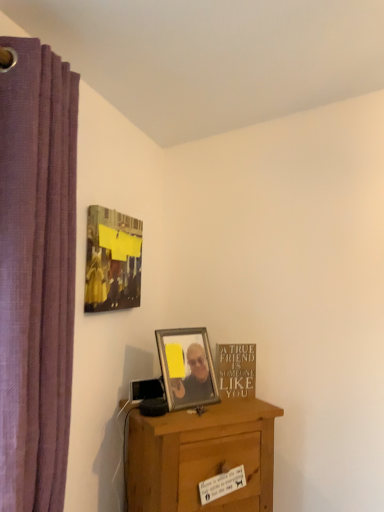
Question: Could you tell me if metallic silver picture frame at center, acting as the 2th picture frame starting from the top, is turned towards gold metallic sign at lower right?

Choices:
 (A) yes
 (B) no

Answer: (B)

Question: Is metallic silver picture frame at center, acting as the 2th picture frame starting from the top, outside of gold metallic sign at lower right?

Choices:
 (A) no
 (B) yes

Answer: (B)

Question: Is metallic silver picture frame at center, the first picture frame when ordered from bottom to top, next to gold metallic sign at lower right?

Choices:
 (A) no
 (B) yes

Answer: (A)

Question: Considering the relative sizes of metallic silver picture frame at center, the first picture frame when ordered from bottom to top, and gold metallic sign at lower right in the image provided, is metallic silver picture frame at center, the first picture frame when ordered from bottom to top, wider than gold metallic sign at lower right?

Choices:
 (A) no
 (B) yes

Answer: (B)

Question: Is gold metallic sign at lower right surrounded by metallic silver picture frame at center, which is the second picture frame from left to right?

Choices:
 (A) no
 (B) yes

Answer: (A)

Question: From their relative heights in the image, would you say matte black picture frame at upper left, which is the 1th picture frame in left-to-right order, is taller or shorter than wooden desk at lower center?

Choices:
 (A) short
 (B) tall

Answer: (A)

Question: In terms of size, does matte black picture frame at upper left, placed as the first picture frame when sorted from top to bottom, appear bigger or smaller than wooden desk at lower center?

Choices:
 (A) small
 (B) big

Answer: (A)

Question: From the image's perspective, is matte black picture frame at upper left, placed as the first picture frame when sorted from top to bottom, above or below wooden desk at lower center?

Choices:
 (A) above
 (B) below

Answer: (A)

Question: Which is correct: matte black picture frame at upper left, the second picture frame from the right, is inside wooden desk at lower center, or outside of it?

Choices:
 (A) inside
 (B) outside

Answer: (B)

Question: Would you say matte black picture frame at upper left, the second picture frame from the right, is inside or outside gold metallic sign at lower right?

Choices:
 (A) inside
 (B) outside

Answer: (B)

Question: Looking at their shapes, would you say matte black picture frame at upper left, which is the 1th picture frame in left-to-right order, is wider or thinner than gold metallic sign at lower right?

Choices:
 (A) wide
 (B) thin

Answer: (A)

Question: From the image's perspective, is matte black picture frame at upper left, which is the 1th picture frame in left-to-right order, above or below gold metallic sign at lower right?

Choices:
 (A) below
 (B) above

Answer: (B)

Question: Relative to gold metallic sign at lower right, is matte black picture frame at upper left, which is the 2th picture frame from bottom to top, in front or behind?

Choices:
 (A) front
 (B) behind

Answer: (A)

Question: Does point (62, 145) appear closer or farther from the camera than point (165, 359)?

Choices:
 (A) farther
 (B) closer

Answer: (B)

Question: From the image's perspective, relative to metallic silver picture frame at center, which appears as the first picture frame when viewed from the right, is purple fabric curtain at left above or below?

Choices:
 (A) below
 (B) above

Answer: (B)